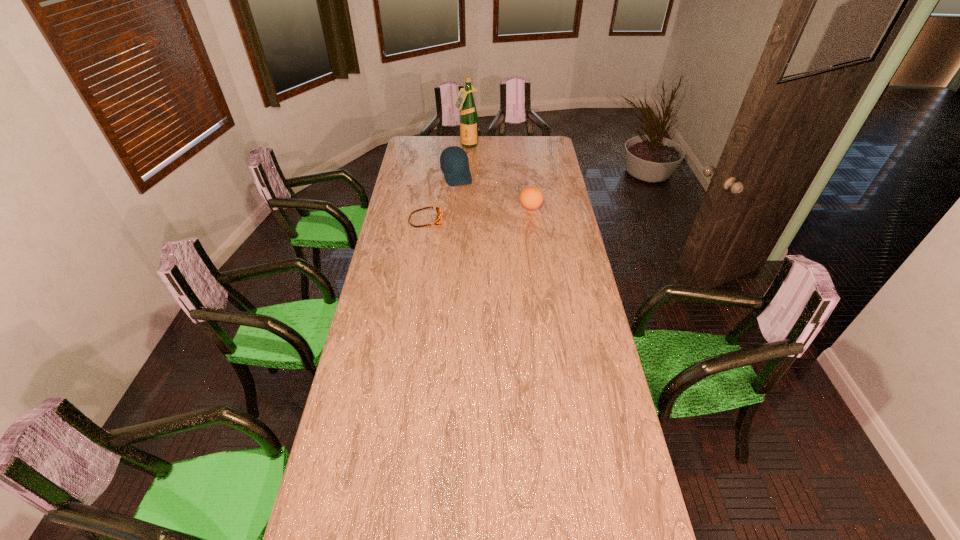
Where is `the shortest object`? the shortest object is located at coordinates (438, 220).

Where is `the rightmost object`? The width and height of the screenshot is (960, 540). the rightmost object is located at coordinates (531, 197).

You are a GUI agent. You are given a task and a screenshot of the screen. Output one action in this format:
    pyautogui.click(x=<x>, y=<y>)
    Task: Click on the orange
    The image size is (960, 540).
    Given the screenshot: What is the action you would take?
    coord(531,197)

What are the coordinates of `the farthest object` in the screenshot? It's located at (465, 102).

You are a GUI agent. You are given a task and a screenshot of the screen. Output one action in this format:
    pyautogui.click(x=<x>, y=<y>)
    Task: Click on the liquor
    The width and height of the screenshot is (960, 540).
    Given the screenshot: What is the action you would take?
    pyautogui.click(x=465, y=102)

Where is `the third nearest object`? the third nearest object is located at coordinates (454, 163).

This screenshot has height=540, width=960. Find the location of `baseball cap`. baseball cap is located at coordinates (454, 163).

The width and height of the screenshot is (960, 540). Find the location of `vacant space located 0.240m with the lenses facing forward on the goggles`. vacant space located 0.240m with the lenses facing forward on the goggles is located at coordinates (491, 220).

Find the location of a particular element. The height and width of the screenshot is (540, 960). free space located 0.380m on the left of the orange is located at coordinates (445, 207).

You are a GUI agent. You are given a task and a screenshot of the screen. Output one action in this format:
    pyautogui.click(x=<x>, y=<y>)
    Task: Click on the free space located 0.150m on the front-facing side of the farthest object
    
    Given the screenshot: What is the action you would take?
    pyautogui.click(x=470, y=163)